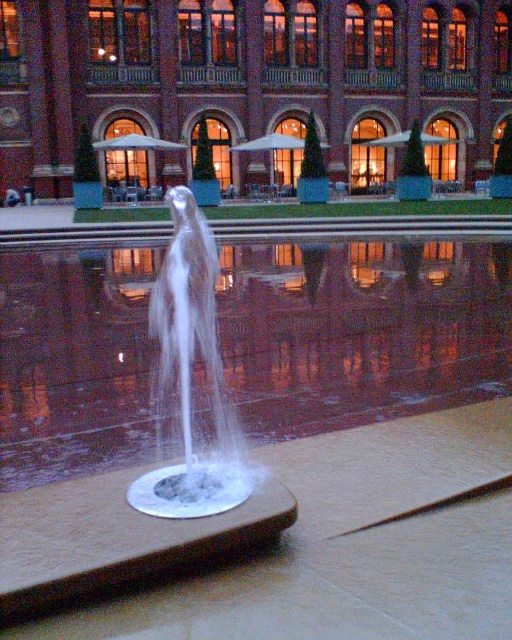
Question: Does clear liquid water at center appear on the right side of white translucent water at center?

Choices:
 (A) yes
 (B) no

Answer: (A)

Question: Can you confirm if clear liquid water at center is positioned to the left of white translucent water at center?

Choices:
 (A) no
 (B) yes

Answer: (A)

Question: Which point appears farthest from the camera in this image?

Choices:
 (A) (245, 499)
 (B) (318, 269)

Answer: (B)

Question: Does clear liquid water at center appear under white translucent water at center?

Choices:
 (A) no
 (B) yes

Answer: (B)

Question: Which point is closer to the camera?

Choices:
 (A) (212, 333)
 (B) (17, 308)

Answer: (A)